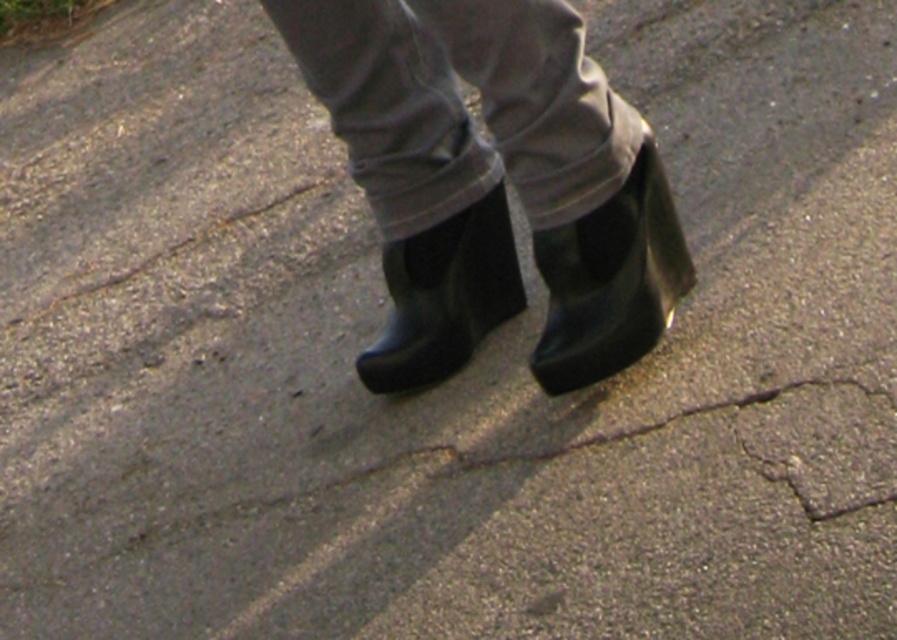
You are a delivery robot trying to avoid stepping on the rubber boots at center. What coordinates should you target to move around them?

The rubber boots at center are located at coordinates point (493,180). To avoid them, the delivery robot should target coordinates either to the left or right of this point, such as point (493,96) or point (493,266).

You are trying to decide which boot to wear for a walk. You have the rubber boots at center and the black rubber boot at center. Which one is wider?

The rubber boots at center are wider than the black rubber boot at center.